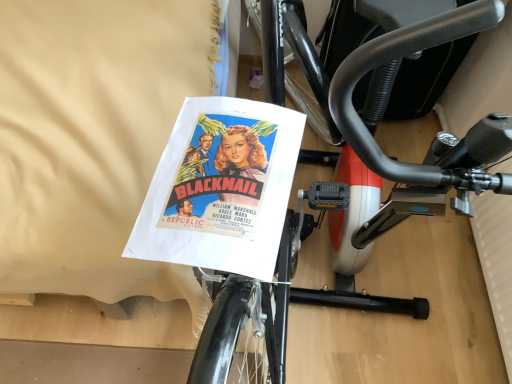
Question: Does black matte exercise bike at center have a larger size compared to white paper at upper left?

Choices:
 (A) no
 (B) yes

Answer: (A)

Question: From a real-world perspective, is black matte exercise bike at center physically below white paper at upper left?

Choices:
 (A) no
 (B) yes

Answer: (A)

Question: Is black matte exercise bike at center not inside white paper at upper left?

Choices:
 (A) yes
 (B) no

Answer: (A)

Question: Is black matte exercise bike at center directly adjacent to white paper at upper left?

Choices:
 (A) yes
 (B) no

Answer: (B)

Question: Is black matte exercise bike at center smaller than white paper at upper left?

Choices:
 (A) yes
 (B) no

Answer: (A)

Question: From the image's perspective, is black matte exercise bike at center on white paper at upper left?

Choices:
 (A) yes
 (B) no

Answer: (B)

Question: Does white paper at upper left turn towards black matte exercise bike at center?

Choices:
 (A) no
 (B) yes

Answer: (A)

Question: Considering the relative sizes of white paper at upper left and black matte exercise bike at center in the image provided, is white paper at upper left wider than black matte exercise bike at center?

Choices:
 (A) no
 (B) yes

Answer: (B)

Question: Does white paper at upper left have a smaller size compared to black matte exercise bike at center?

Choices:
 (A) yes
 (B) no

Answer: (B)

Question: Is black matte exercise bike at center surrounded by white paper at upper left?

Choices:
 (A) yes
 (B) no

Answer: (B)

Question: Does white paper at upper left have a lesser height compared to black matte exercise bike at center?

Choices:
 (A) no
 (B) yes

Answer: (B)

Question: Is white paper at upper left positioned with its back to black matte exercise bike at center?

Choices:
 (A) yes
 (B) no

Answer: (A)

Question: Considering the positions of black matte exercise bike at center and white paper at upper left in the image, is black matte exercise bike at center wider or thinner than white paper at upper left?

Choices:
 (A) thin
 (B) wide

Answer: (A)